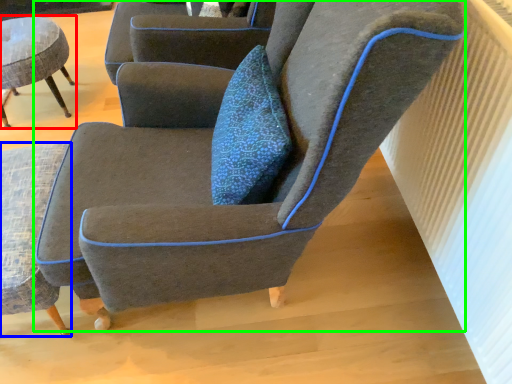
Question: Estimate the real-world distances between objects in this image. Which object is farther from chair (highlighted by a red box), chair (highlighted by a blue box) or chair (highlighted by a green box)?

Choices:
 (A) chair
 (B) chair

Answer: (B)